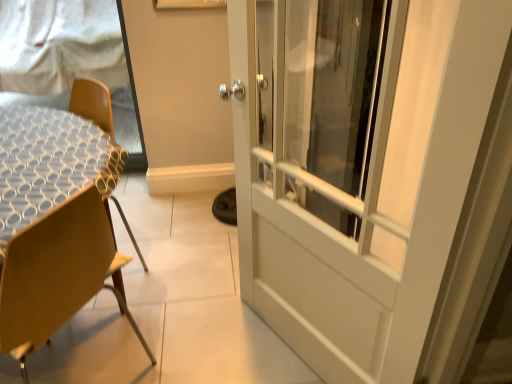
Question: Is white mesh screen at upper left in front of or behind white textured table at left in the image?

Choices:
 (A) front
 (B) behind

Answer: (B)

Question: From a real-world perspective, is white mesh screen at upper left physically located above or below white textured table at left?

Choices:
 (A) above
 (B) below

Answer: (A)

Question: Estimate the real-world distances between objects in this image. Which object is closer to the wooden chair at left?

Choices:
 (A) white mesh screen at upper left
 (B) white textured table at left

Answer: (B)

Question: Which is nearer to the white mesh screen at upper left?

Choices:
 (A) wooden chair at left
 (B) white textured table at left

Answer: (B)